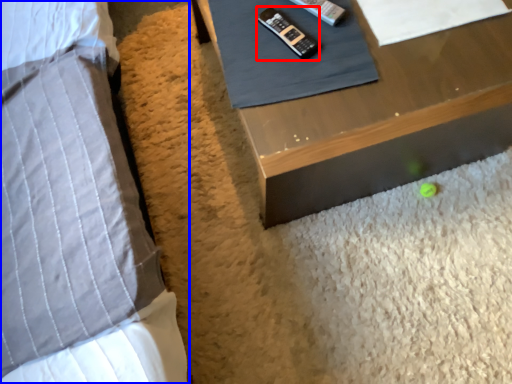
Question: Among these objects, which one is farthest to the camera, control (highlighted by a red box) or bed (highlighted by a blue box)?

Choices:
 (A) control
 (B) bed

Answer: (A)